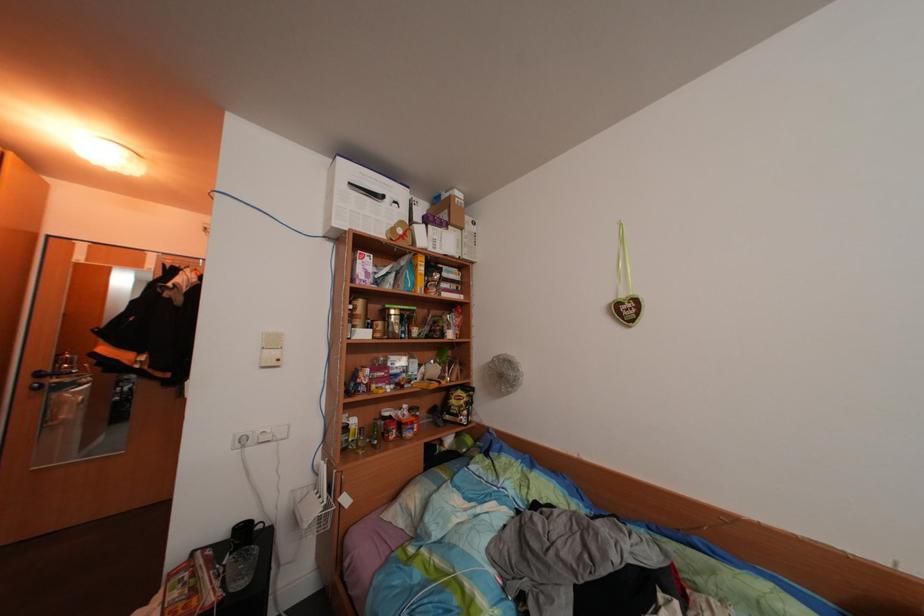
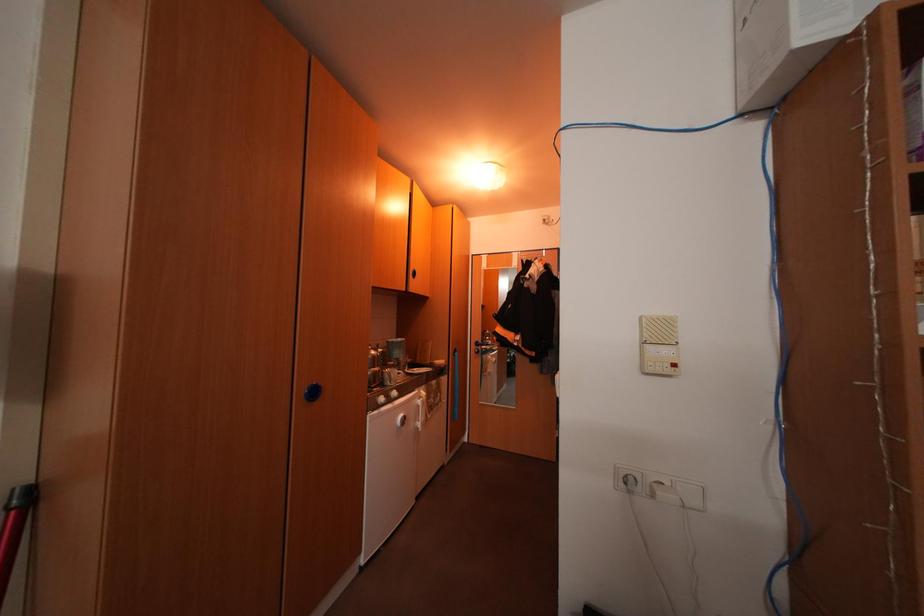
Question: The first image is from the beginning of the video and the second image is from the end. How did the camera likely rotate when shooting the video?

Choices:
 (A) Left
 (B) Right
 (C) Up
 (D) Down

Answer: (A)